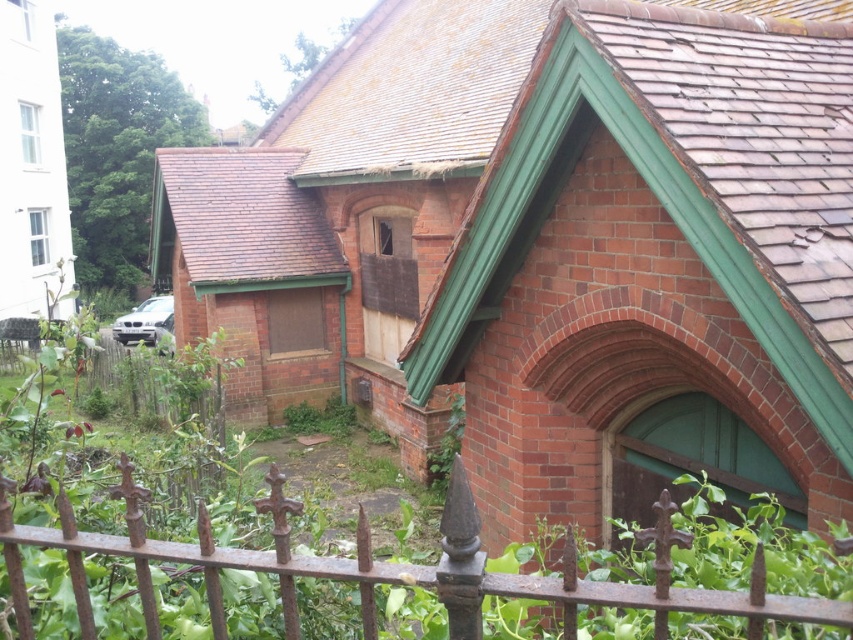
Who is positioned more to the left, rusty iron fence at lower center or brown shingles at upper left?

brown shingles at upper left is more to the left.

The height and width of the screenshot is (640, 853). Describe the element at coordinates (392, 568) in the screenshot. I see `rusty iron fence at lower center` at that location.

Measure the distance between rusty iron fence at lower center and camera.

They are 4.85 feet apart.

The height and width of the screenshot is (640, 853). In order to click on rusty iron fence at lower center in this screenshot , I will do `click(392, 568)`.

In the scene shown: Does rusty iron fence at lower center have a lesser width compared to brown shingles at upper center?

Yes.

Does rusty iron fence at lower center have a smaller size compared to brown shingles at upper center?

Yes, rusty iron fence at lower center is smaller than brown shingles at upper center.

Is point (572, 634) positioned after point (325, 72)?

No, it is in front of (325, 72).

The image size is (853, 640). I want to click on rusty iron fence at lower center, so click(x=392, y=568).

What do you see at coordinates (412, 88) in the screenshot? I see `brown shingles at upper center` at bounding box center [412, 88].

Is point (286, 104) farther from camera compared to point (190, 228)?

Yes.

You are a GUI agent. You are given a task and a screenshot of the screen. Output one action in this format:
    pyautogui.click(x=<x>, y=<y>)
    Task: Click on the brown shingles at upper center
    This screenshot has height=640, width=853.
    Given the screenshot: What is the action you would take?
    pyautogui.click(x=412, y=88)